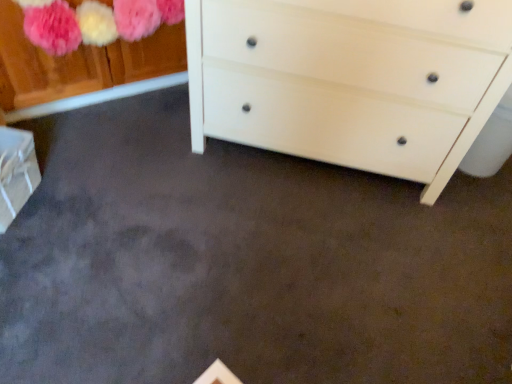
I want to click on vacant space positioned to the left of white matte chest of drawers at center, so click(127, 163).